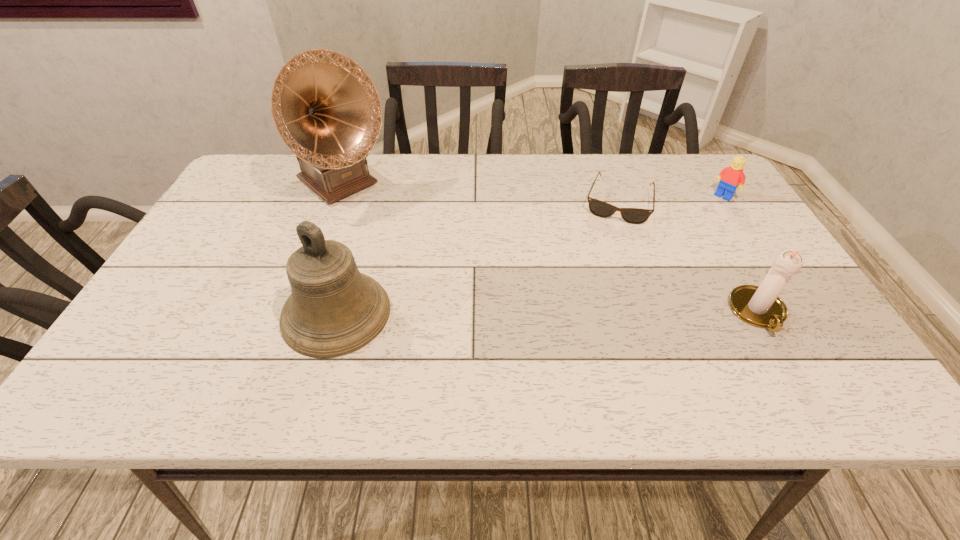
This screenshot has width=960, height=540. I want to click on the second tallest object, so tap(334, 310).

Find the location of a particular element. Image resolution: width=960 pixels, height=540 pixels. candle holder is located at coordinates (760, 306).

At what (x,y) coordinates should I click in order to perform the action: click on the second object from right to left. Please return your answer as a coordinate pair (x, y). The width and height of the screenshot is (960, 540). Looking at the image, I should click on (760, 306).

You are a GUI agent. You are given a task and a screenshot of the screen. Output one action in this format:
    pyautogui.click(x=<x>, y=<y>)
    Task: Click on the third object from left to right
    
    Given the screenshot: What is the action you would take?
    pyautogui.click(x=598, y=208)

The image size is (960, 540). I want to click on sunglasses, so click(x=598, y=208).

Locate an element on the screen. the fourth tallest object is located at coordinates (730, 177).

You are a GUI agent. You are given a task and a screenshot of the screen. Output one action in this format:
    pyautogui.click(x=<x>, y=<y>)
    Task: Click on the Lego
    The image size is (960, 540).
    Given the screenshot: What is the action you would take?
    pyautogui.click(x=730, y=177)

You are a GUI agent. You are given a task and a screenshot of the screen. Output one action in this format:
    pyautogui.click(x=<x>, y=<y>)
    Task: Click on the phonograph record
    
    Given the screenshot: What is the action you would take?
    pyautogui.click(x=325, y=107)

At what (x,y) coordinates should I click in order to perform the action: click on vacant area situated on the left of the second tallest object. Please return your answer as a coordinate pair (x, y). Looking at the image, I should click on (151, 313).

Locate an element on the screen. The width and height of the screenshot is (960, 540). vacant position located 0.190m on the lenses of the sunglasses is located at coordinates (602, 271).